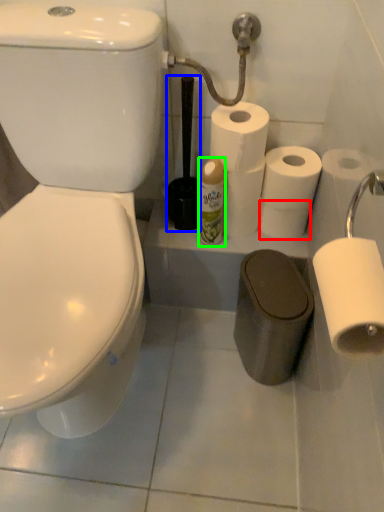
Question: Based on their relative distances, which object is nearer to toilet paper (highlighted by a red box)? Choose from brush (highlighted by a blue box) and toiletry (highlighted by a green box).

Choices:
 (A) brush
 (B) toiletry

Answer: (B)